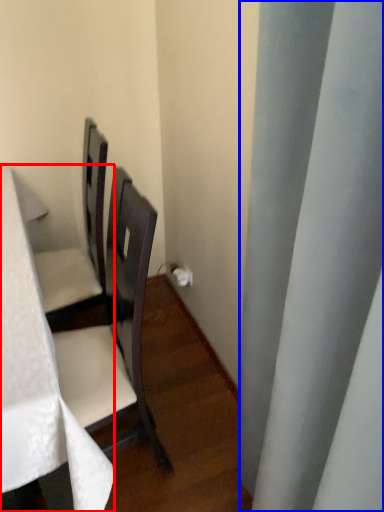
Question: Which object is further to the camera taking this photo, table (highlighted by a red box) or curtain (highlighted by a blue box)?

Choices:
 (A) table
 (B) curtain

Answer: (A)